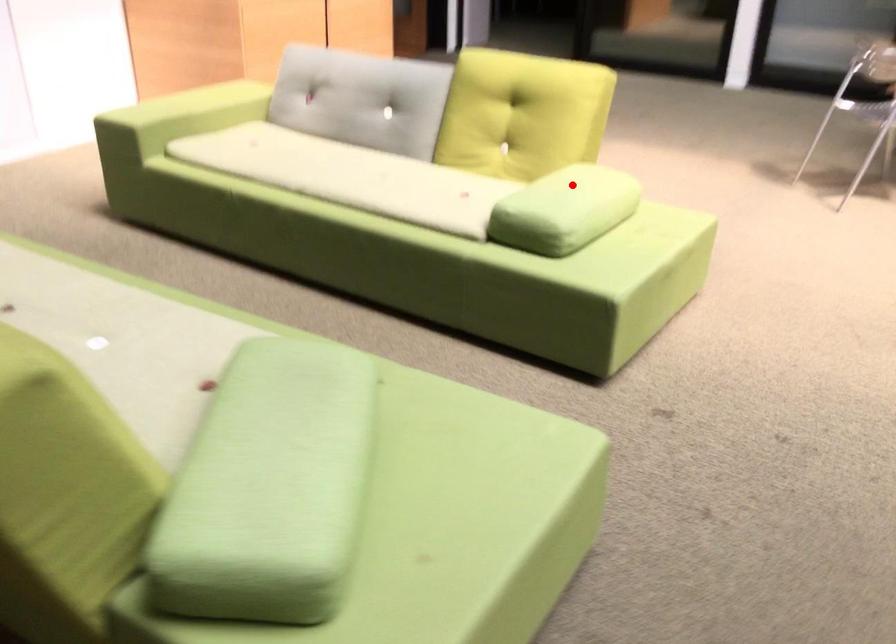
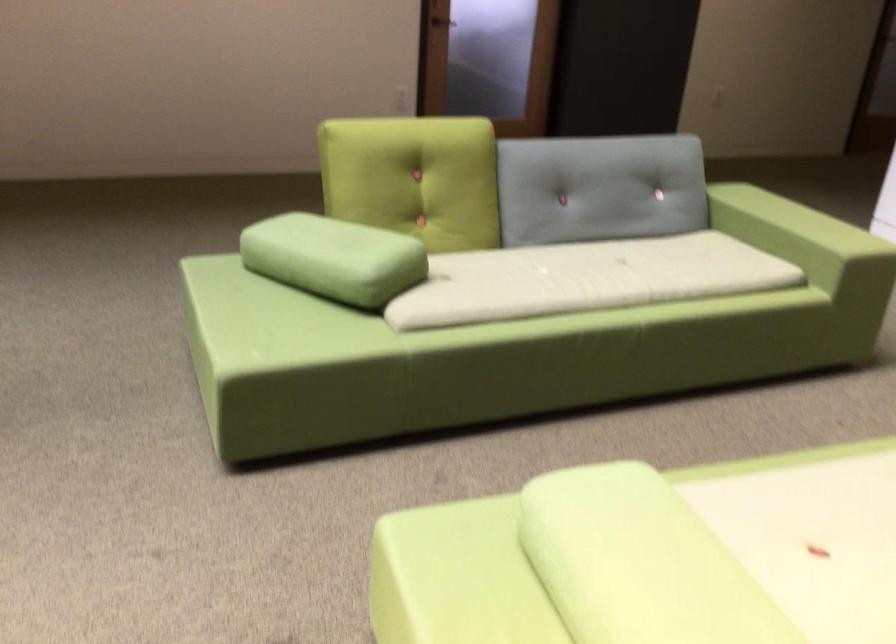
Question: I am providing you with two images of the same scene from different viewpoints. Image1 has a red point marked. In image2, the corresponding 3D location appears at what relative position? Reply with the corresponding letter.

Choices:
 (A) Closer
 (B) Farther

Answer: (A)